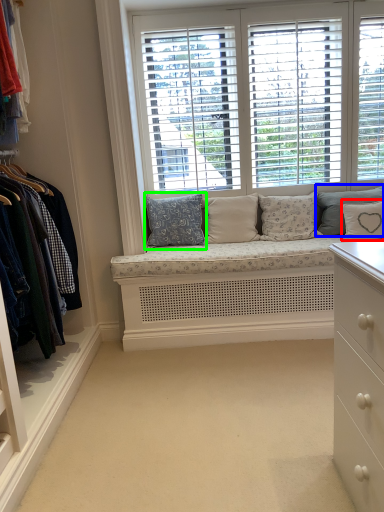
Question: Estimate the real-world distances between objects in this image. Which object is closer to pillow (highlighted by a red box), pillow (highlighted by a blue box) or pillow (highlighted by a green box)?

Choices:
 (A) pillow
 (B) pillow

Answer: (A)